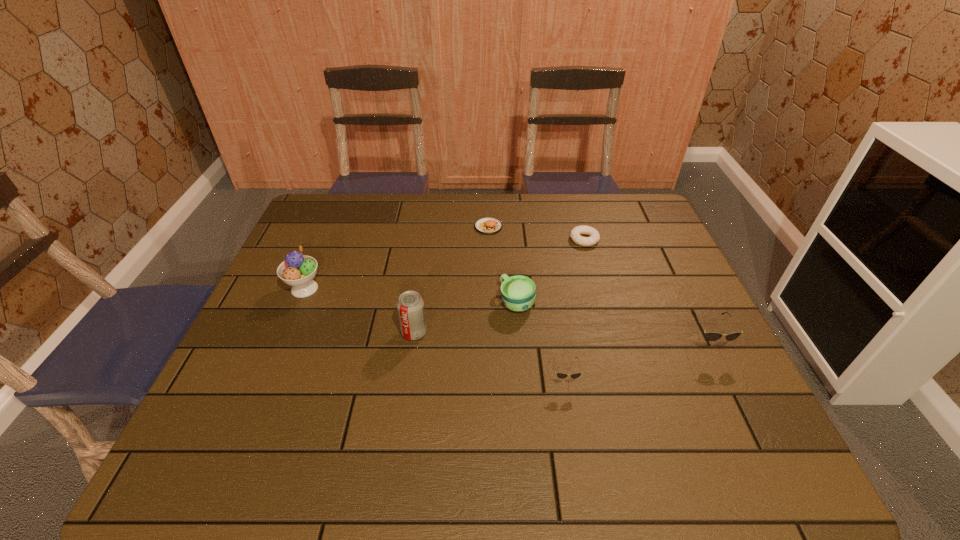
The image size is (960, 540). In order to click on the nearer sunglasses in this screenshot , I will do `click(560, 375)`.

In order to click on the shorter sunglasses in this screenshot , I will do `click(560, 375)`.

In order to click on the right sunglasses in this screenshot , I will do 711,336.

This screenshot has width=960, height=540. I want to click on the farther sunglasses, so click(711, 336).

Locate an element on the screen. The width and height of the screenshot is (960, 540). the second shortest object is located at coordinates (488, 225).

Locate an element on the screen. The image size is (960, 540). the shortest object is located at coordinates (576, 232).

Where is `doughnut`? doughnut is located at coordinates (576, 232).

Identify the location of soda can. This screenshot has height=540, width=960. (411, 311).

Where is `icecream`? The width and height of the screenshot is (960, 540). icecream is located at coordinates (298, 270).

This screenshot has width=960, height=540. I want to click on cup, so click(518, 293).